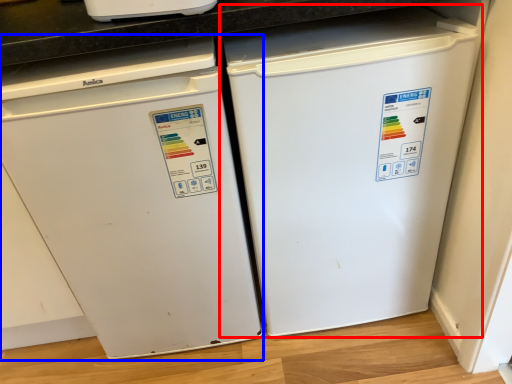
Question: Which of the following is the closest to the observer, refrigerator (highlighted by a red box) or home appliance (highlighted by a blue box)?

Choices:
 (A) refrigerator
 (B) home appliance

Answer: (B)